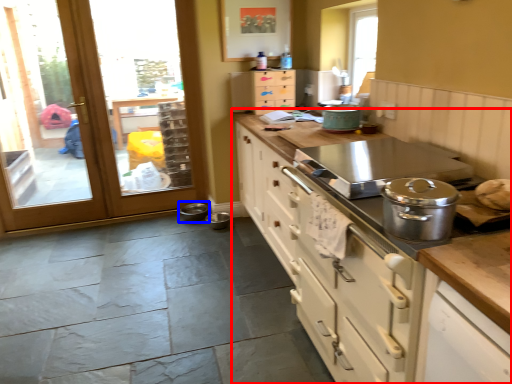
Question: Which of the following is the farthest to the observer, cabinetry (highlighted by a red box) or appliance (highlighted by a blue box)?

Choices:
 (A) cabinetry
 (B) appliance

Answer: (B)